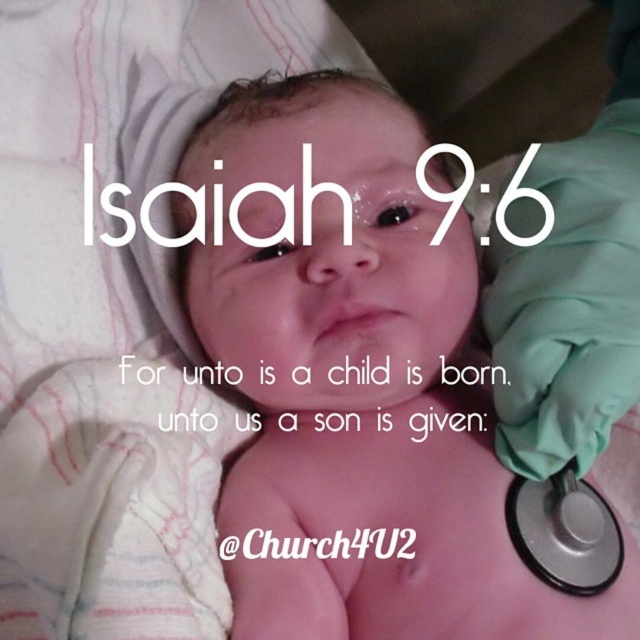
Question: Can you confirm if pink smooth skin at center is positioned to the right of white striped fabric at center?

Choices:
 (A) yes
 (B) no

Answer: (A)

Question: Which of the following is the closest to the observer?

Choices:
 (A) teal fabric stethoscope at right
 (B) black rubber stethoscope at lower right

Answer: (A)

Question: Which is nearer to the black rubber stethoscope at lower right?

Choices:
 (A) white striped fabric at center
 (B) pink smooth skin at center
 (C) teal fabric stethoscope at right

Answer: (C)

Question: In this image, where is pink smooth skin at center located relative to teal fabric stethoscope at right?

Choices:
 (A) right
 (B) left

Answer: (B)

Question: Which object appears farthest from the camera in this image?

Choices:
 (A) pink smooth skin at center
 (B) white striped fabric at center
 (C) teal fabric stethoscope at right

Answer: (C)

Question: Does pink smooth skin at center have a greater width compared to white striped fabric at center?

Choices:
 (A) no
 (B) yes

Answer: (B)